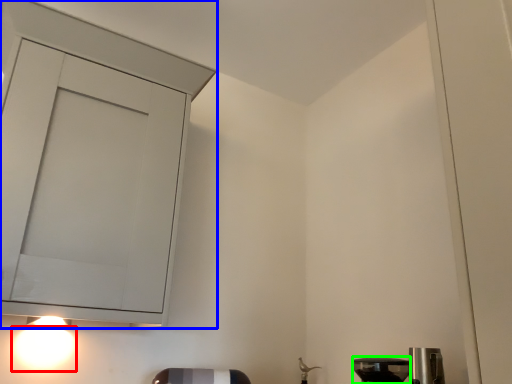
Question: Which object is positioned farthest from light (highlighted by a red box)? Select from cabinetry (highlighted by a blue box) and appliance (highlighted by a green box).

Choices:
 (A) cabinetry
 (B) appliance

Answer: (B)